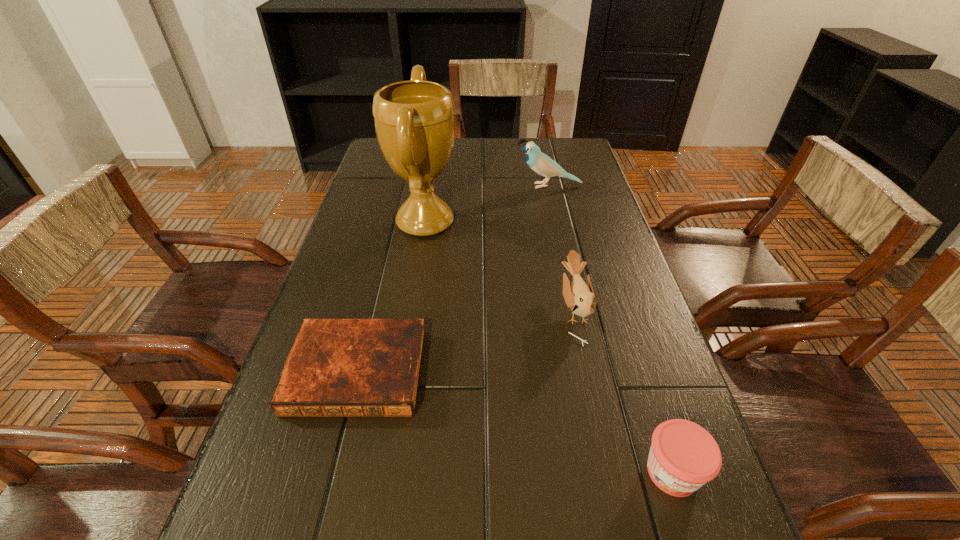
Image resolution: width=960 pixels, height=540 pixels. In the image, there is a desktop. In order to click on vacant space at the left edge in this screenshot , I will do `click(386, 192)`.

Locate an element on the screen. This screenshot has width=960, height=540. vacant space at the right edge of the desktop is located at coordinates (732, 528).

Where is `empty space that is in between the Bible and the taller bird`? Image resolution: width=960 pixels, height=540 pixels. empty space that is in between the Bible and the taller bird is located at coordinates (453, 279).

Image resolution: width=960 pixels, height=540 pixels. What are the coordinates of `free point between the tallest object and the nearest object` in the screenshot? It's located at (549, 347).

This screenshot has height=540, width=960. What are the coordinates of `empty space between the nearer bird and the tallest object` in the screenshot? It's located at (500, 266).

What are the coordinates of `free space between the fourth tallest object and the farther bird` in the screenshot? It's located at (611, 329).

Where is `unoccupied area between the nearest object and the taller bird`? This screenshot has width=960, height=540. unoccupied area between the nearest object and the taller bird is located at coordinates (611, 329).

In order to click on blank region between the farther bird and the Bible in this screenshot , I will do `click(453, 279)`.

Find the location of `vacant area that lies between the fourth tallest object and the shortest object`. vacant area that lies between the fourth tallest object and the shortest object is located at coordinates (515, 421).

At what (x,y) coordinates should I click in order to perform the action: click on vacant space that's between the fourth shortest object and the nearest object. Please return your answer as a coordinate pair (x, y). Looking at the image, I should click on (611, 329).